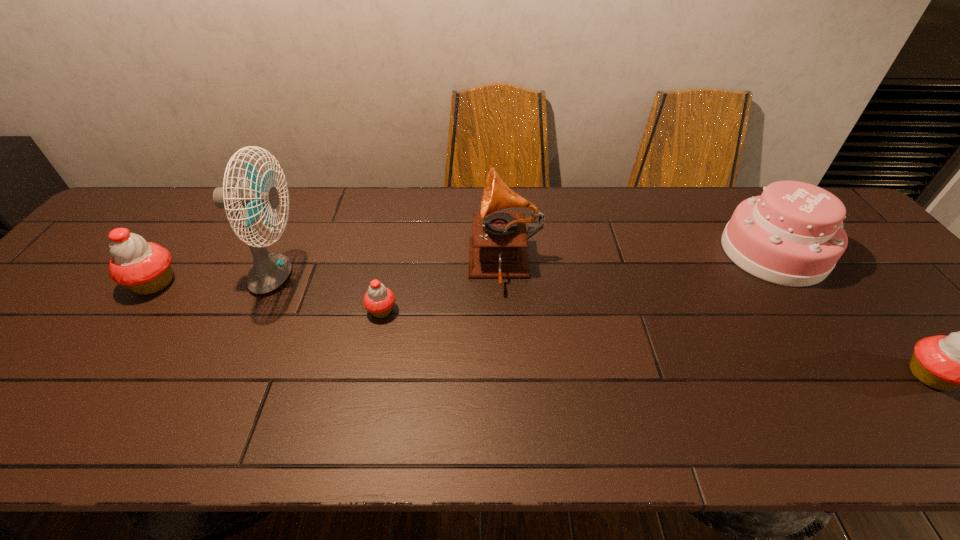
In order to click on free space at the right edge of the desktop in this screenshot , I will do `click(859, 291)`.

Identify the location of free space between the leftmost object and the fourth object from left to right. Image resolution: width=960 pixels, height=540 pixels. (329, 275).

Locate an element on the screen. Image resolution: width=960 pixels, height=540 pixels. free space between the fifth shortest object and the shortest cupcake is located at coordinates (444, 288).

You are a GUI agent. You are given a task and a screenshot of the screen. Output one action in this format:
    pyautogui.click(x=<x>, y=<y>)
    Task: Click on the free space between the phonograph record and the tallest object
    Image resolution: width=960 pixels, height=540 pixels.
    Given the screenshot: What is the action you would take?
    pyautogui.click(x=391, y=272)

The image size is (960, 540). I want to click on empty space that is in between the shortest object and the birthday cake, so click(577, 281).

Image resolution: width=960 pixels, height=540 pixels. In order to click on free space between the second cupcake from left to right and the birthday cake in this screenshot , I will do click(577, 281).

Locate an element on the screen. free spot between the second tallest object and the fan is located at coordinates tap(391, 272).

This screenshot has height=540, width=960. Find the location of `vacant area between the phonograph record and the birthday cake`. vacant area between the phonograph record and the birthday cake is located at coordinates (639, 259).

Identify the location of free space between the birthday cake and the fourth object from left to right. The image size is (960, 540). (639, 259).

Identify the location of vacant area that lies between the leftmost object and the birthday cake. Image resolution: width=960 pixels, height=540 pixels. (464, 268).